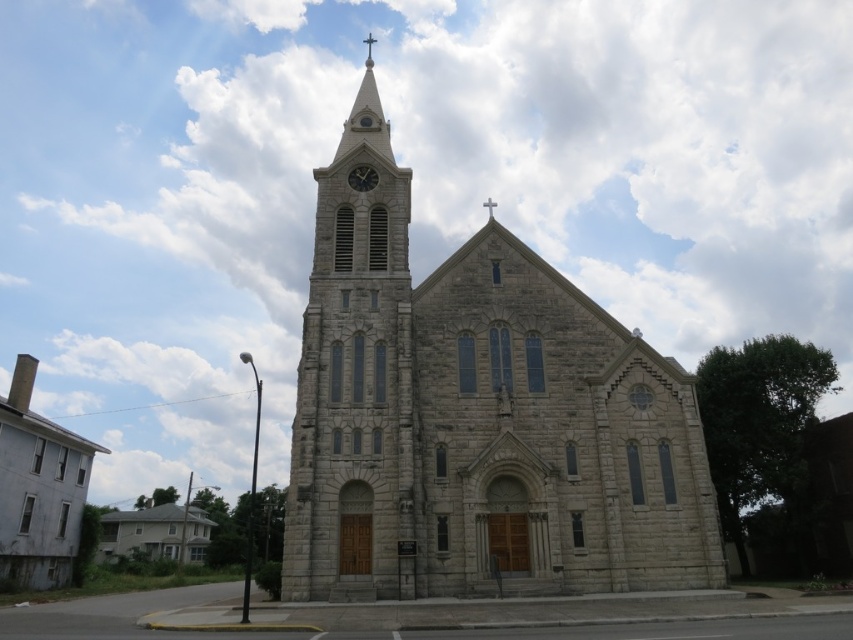
You are standing in front of the grand stone church and notice a point marked at coordinates (357, 384). Based on the scene description, what significant architectural feature is located at this point?

The point at coordinates (357, 384) marks the location of the gray stone clock tower at center left, which features a tall narrow bell tower with a pointed roof and cross at its peak, as well as a visible clock face near the top.